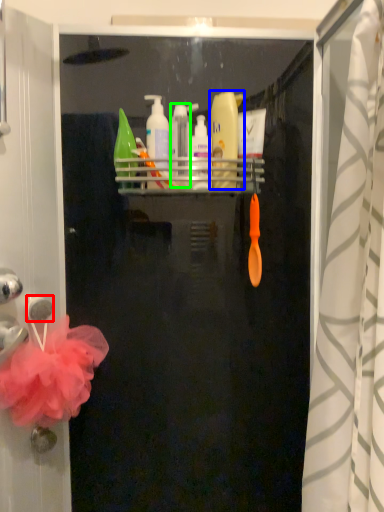
Question: Based on their relative distances, which object is nearer to towel bar (highlighted by a red box)? Choose from cleaning product (highlighted by a blue box) and toiletry (highlighted by a green box).

Choices:
 (A) cleaning product
 (B) toiletry

Answer: (B)